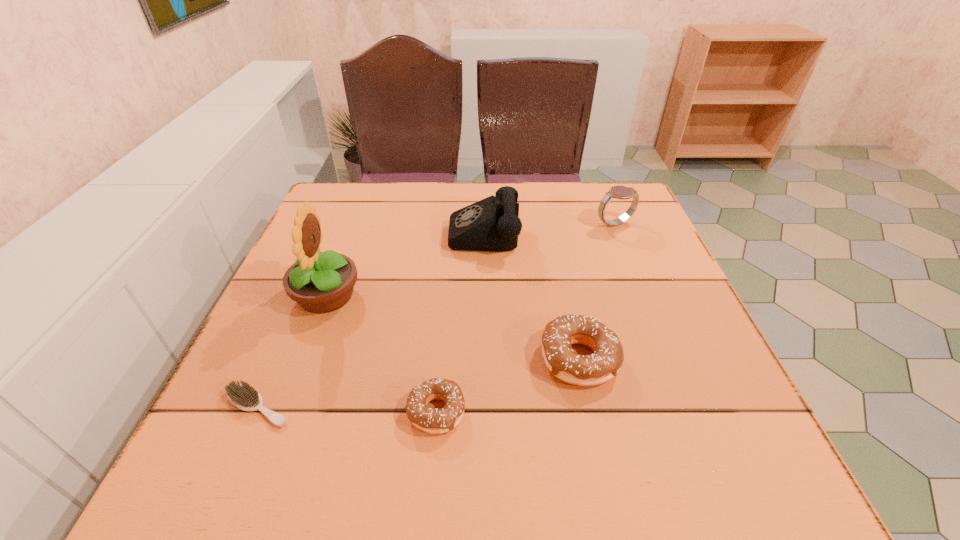
You are a GUI agent. You are given a task and a screenshot of the screen. Output one action in this format:
    pyautogui.click(x=<x>, y=<y>)
    Task: Click on the vacant space situated on the right of the left doughnut
    
    Given the screenshot: What is the action you would take?
    pyautogui.click(x=501, y=411)

This screenshot has width=960, height=540. Identify the location of vacant space situated on the back of the fifth object from left to right. (551, 225).

In order to click on free spot located on the dial of the second tallest object in this screenshot , I will do `click(420, 228)`.

Find the location of a particular element. This screenshot has width=960, height=540. vacant space situated on the dial of the second tallest object is located at coordinates click(349, 228).

Locate an element on the screen. free spot located 0.310m on the dial of the second tallest object is located at coordinates (330, 228).

Locate an element on the screen. free space located on the face of the tallest object is located at coordinates (527, 296).

I want to click on free location located on the front of the rightmost object, so click(x=651, y=314).

At what (x,y) coordinates should I click in order to perform the action: click on free region located 0.310m on the right of the shortest object. Please return your answer as a coordinate pair (x, y). Image resolution: width=960 pixels, height=540 pixels. Looking at the image, I should click on (477, 407).

Where is `telephone situated at the far edge`? telephone situated at the far edge is located at coordinates (492, 224).

What are the coordinates of `watch that is at the far edge` in the screenshot? It's located at (620, 192).